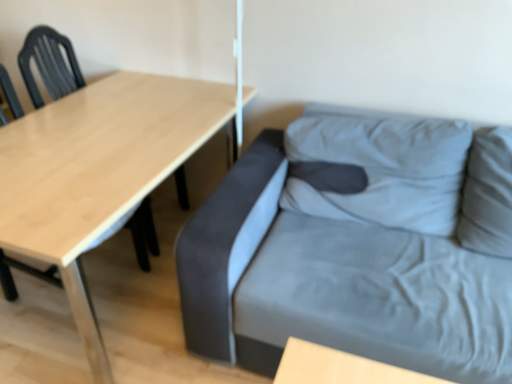
Question: From a real-world perspective, is suede gray couch at right located beneath wooden table at left?

Choices:
 (A) no
 (B) yes

Answer: (A)

Question: Can you confirm if suede gray couch at right is positioned to the left of wooden table at left?

Choices:
 (A) yes
 (B) no

Answer: (B)

Question: Is suede gray couch at right positioned with its back to wooden table at left?

Choices:
 (A) yes
 (B) no

Answer: (B)

Question: Is suede gray couch at right bigger than wooden table at left?

Choices:
 (A) yes
 (B) no

Answer: (A)

Question: From the image's perspective, is suede gray couch at right on wooden table at left?

Choices:
 (A) no
 (B) yes

Answer: (A)

Question: Is suede gray couch at right beside wooden table at left?

Choices:
 (A) no
 (B) yes

Answer: (A)

Question: Is matte black chair at left facing away from suede gray couch at right?

Choices:
 (A) no
 (B) yes

Answer: (A)

Question: Is matte black chair at left far away from suede gray couch at right?

Choices:
 (A) yes
 (B) no

Answer: (B)

Question: From the image's perspective, is matte black chair at left over suede gray couch at right?

Choices:
 (A) no
 (B) yes

Answer: (B)

Question: Is matte black chair at left shorter than suede gray couch at right?

Choices:
 (A) no
 (B) yes

Answer: (A)

Question: Considering the relative sizes of matte black chair at left and suede gray couch at right in the image provided, is matte black chair at left bigger than suede gray couch at right?

Choices:
 (A) no
 (B) yes

Answer: (A)

Question: Is matte black chair at left wider than suede gray couch at right?

Choices:
 (A) no
 (B) yes

Answer: (A)

Question: Is wooden table at left with suede gray couch at right?

Choices:
 (A) no
 (B) yes

Answer: (A)